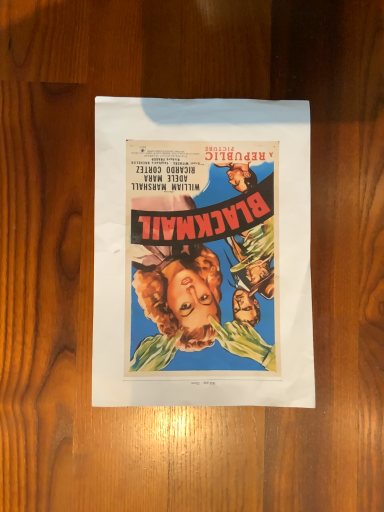
Identify the location of vibrant paper poster at center. This screenshot has width=384, height=512. [x=202, y=253].

Describe the element at coordinates (202, 253) in the screenshot. I see `vibrant paper poster at center` at that location.

Locate an element on the screen. vibrant paper poster at center is located at coordinates pos(202,253).